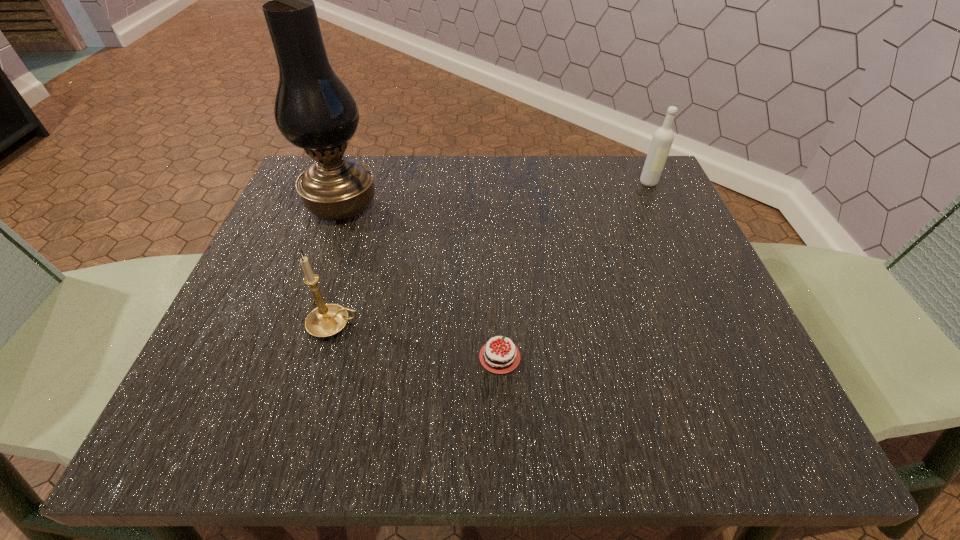
I want to click on the tallest object, so click(x=314, y=110).

This screenshot has height=540, width=960. Find the location of `the rightmost object`. the rightmost object is located at coordinates (662, 140).

Identify the location of candle holder. (326, 320).

Locate an element on the screen. This screenshot has width=960, height=540. the second object from right to left is located at coordinates (497, 359).

In order to click on the shortest object in this screenshot , I will do `click(497, 359)`.

Locate an element on the screen. free space located 0.070m on the back of the oil lamp is located at coordinates (355, 167).

Locate an element on the screen. free point located on the left of the rightmost object is located at coordinates (521, 183).

Find the location of `vacant area situated on the handle side of the candle holder`. vacant area situated on the handle side of the candle holder is located at coordinates click(x=557, y=325).

Locate an element on the screen. Image resolution: width=960 pixels, height=540 pixels. free space located on the right of the chocolate cake is located at coordinates (624, 357).

Where is `oil lamp positioned at the far edge`? This screenshot has width=960, height=540. oil lamp positioned at the far edge is located at coordinates (314, 110).